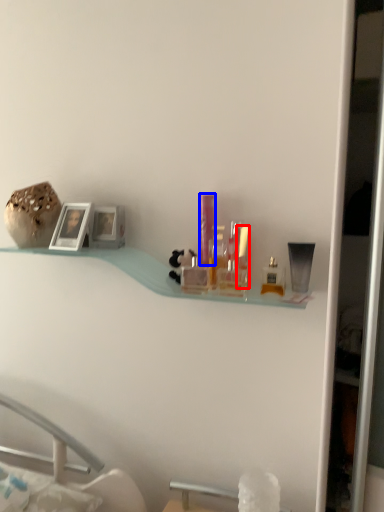
Question: Which object is closer to the camera taking this photo, toiletry (highlighted by a red box) or toiletry (highlighted by a blue box)?

Choices:
 (A) toiletry
 (B) toiletry

Answer: (A)